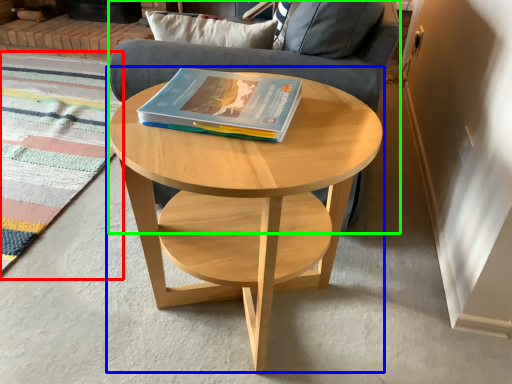
Question: Which object is positioned closest to mat (highlighted by a red box)? Select from coffee table (highlighted by a blue box) and armchair (highlighted by a green box).

Choices:
 (A) coffee table
 (B) armchair

Answer: (B)